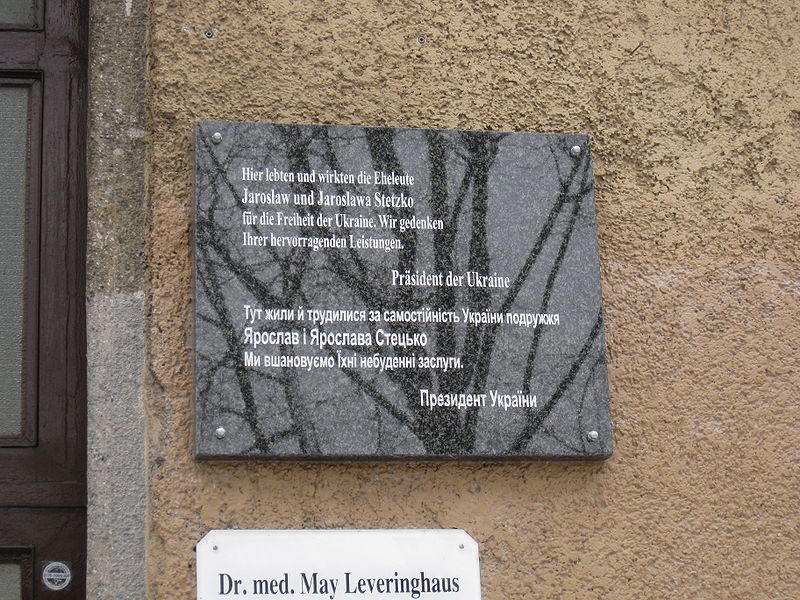
Image resolution: width=800 pixels, height=600 pixels. I want to click on dark wood door trim, so 70,268, 38,531.